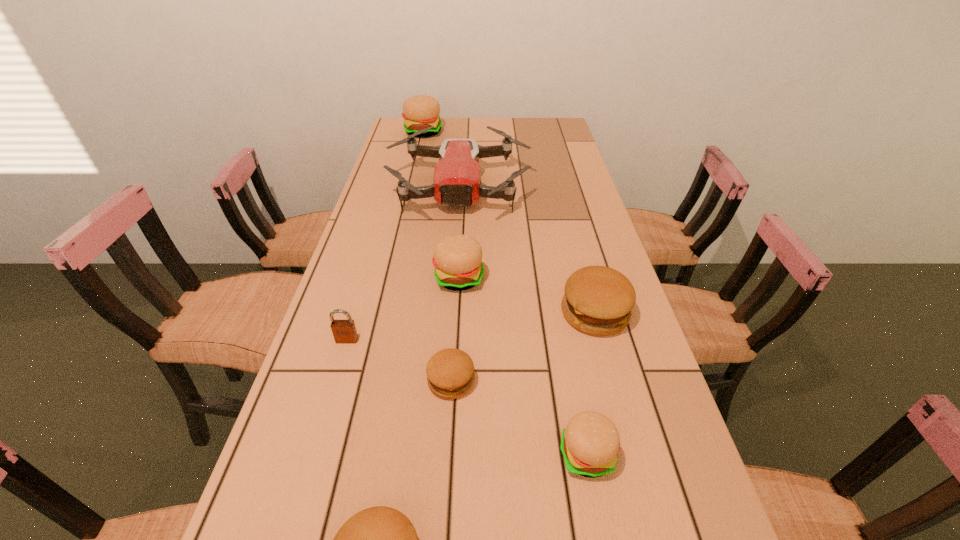
Image resolution: width=960 pixels, height=540 pixels. What are the coordinates of `object present at the far edge` in the screenshot? It's located at (420, 111).

Image resolution: width=960 pixels, height=540 pixels. What are the coordinates of `hamburger at the left edge` in the screenshot? It's located at (420, 111).

Locate an element on the screen. drone that is at the left edge is located at coordinates (456, 182).

This screenshot has height=540, width=960. Find the location of `padlock located in the left edge section of the desktop`. padlock located in the left edge section of the desktop is located at coordinates (344, 331).

The height and width of the screenshot is (540, 960). Find the location of `object located at the far left corner`. object located at the far left corner is located at coordinates (420, 111).

Image resolution: width=960 pixels, height=540 pixels. In the image, there is a desktop. What are the coordinates of `vacant space at the far edge` in the screenshot? It's located at (473, 122).

At what (x,y) coordinates should I click in order to perform the action: click on vacant space at the left edge of the desktop. Please return your answer as a coordinate pair (x, y). Looking at the image, I should click on (367, 316).

Find the location of a particular element. Image resolution: width=960 pixels, height=540 pixels. blank area at the right edge is located at coordinates (545, 176).

Locate an element on the screen. This screenshot has height=540, width=960. vacant area at the far left corner is located at coordinates (397, 122).

Locate an element on the screen. This screenshot has height=540, width=960. vacant region between the smallest beige hamburger and the red drone is located at coordinates (523, 322).